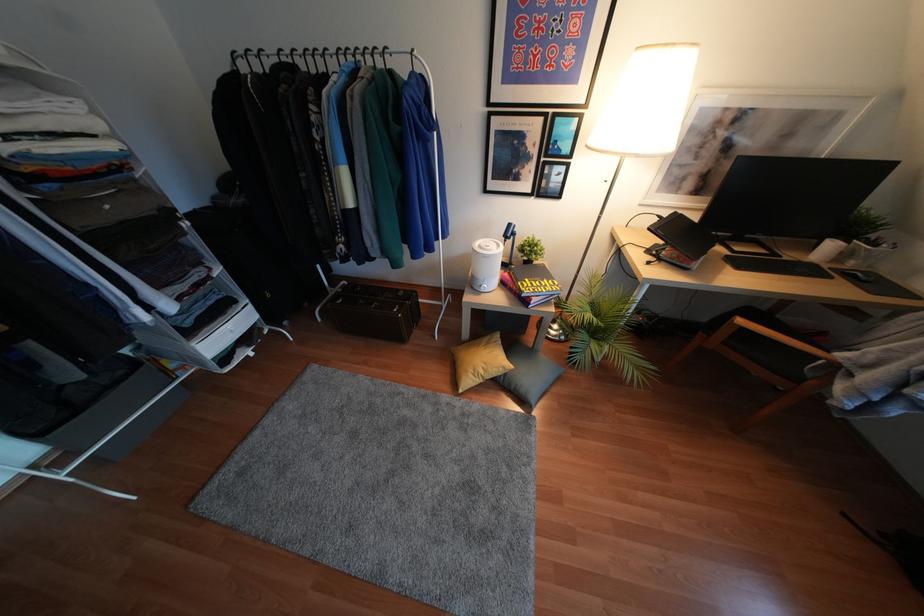
The location [479,361] corresponds to which object?

This point indicates the yellow floor cushion.